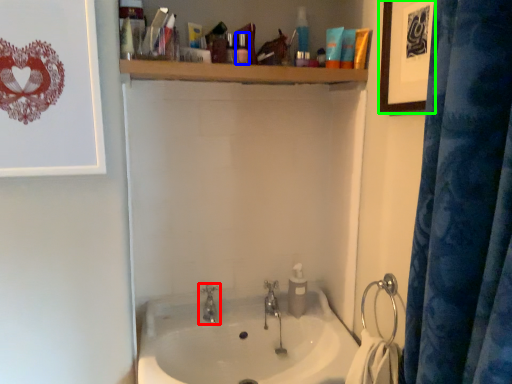
Question: Which object is the closest to the tap (highlighted by a red box)? Choose among these: toiletry (highlighted by a blue box) or picture frame (highlighted by a green box).

Choices:
 (A) toiletry
 (B) picture frame

Answer: (A)